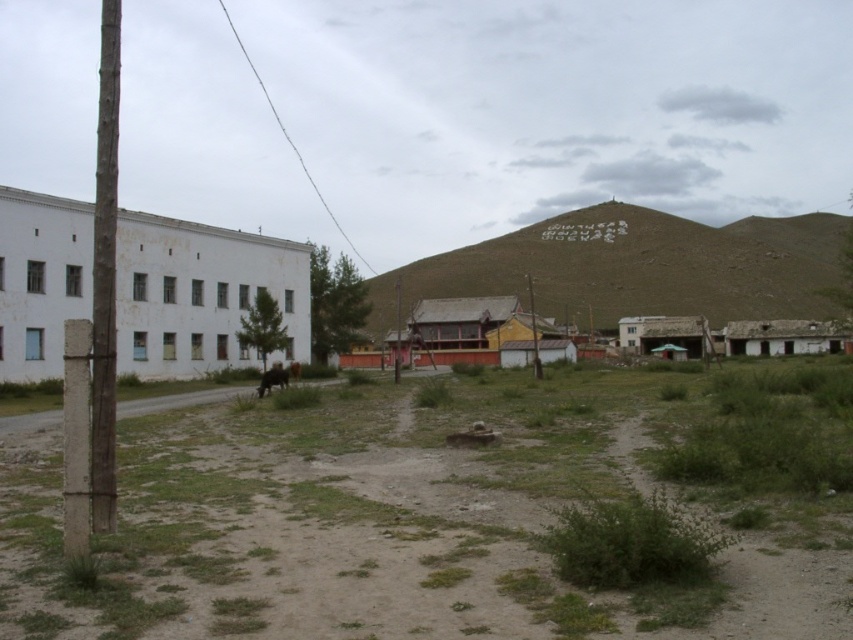
Does dull brown dirt field at center have a greater height compared to brown wooden pole at left?

No, dull brown dirt field at center is not taller than brown wooden pole at left.

Can you confirm if dull brown dirt field at center is thinner than brown wooden pole at left?

Correct, dull brown dirt field at center's width is less than brown wooden pole at left's.

What do you see at coordinates (453, 513) in the screenshot? This screenshot has height=640, width=853. I see `dull brown dirt field at center` at bounding box center [453, 513].

Where is `dull brown dirt field at center`? dull brown dirt field at center is located at coordinates (453, 513).

Between brown wooden pole at left and brown furry dog at center, which one has more height?

Result: With more height is brown wooden pole at left.

This screenshot has width=853, height=640. I want to click on brown wooden pole at left, so click(x=103, y=276).

At what (x,y) coordinates should I click in order to perform the action: click on brown wooden pole at left. Please return your answer as a coordinate pair (x, y). Image resolution: width=853 pixels, height=640 pixels. Looking at the image, I should click on (103, 276).

Does dull brown dirt field at center have a larger size compared to green grassy hillside at center?

No, dull brown dirt field at center is not bigger than green grassy hillside at center.

Does dull brown dirt field at center appear under green grassy hillside at center?

Yes.

The image size is (853, 640). Identify the location of dull brown dirt field at center. (453, 513).

At what (x,y) coordinates should I click in order to perform the action: click on dull brown dirt field at center. Please return your answer as a coordinate pair (x, y). Looking at the image, I should click on (453, 513).